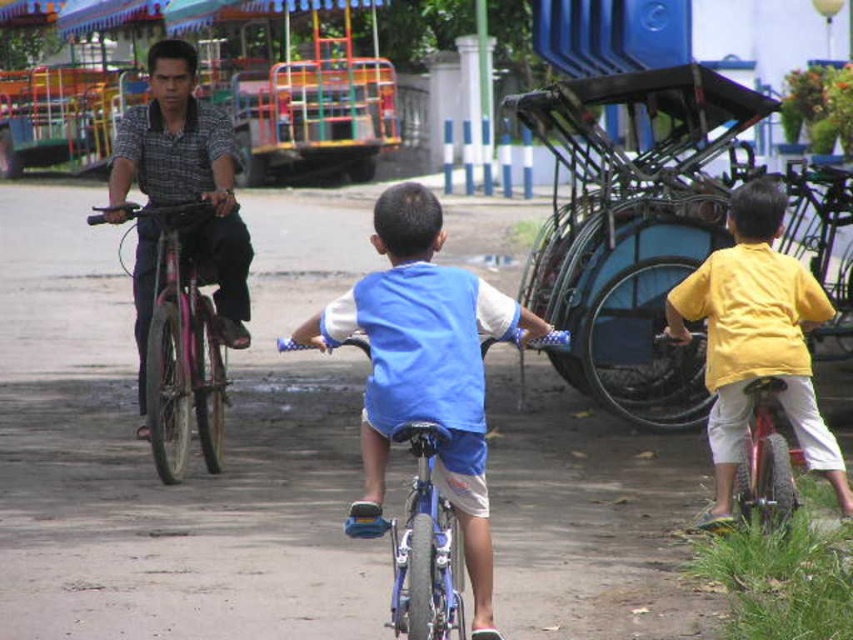
You are a photographer trying to capture a photo of both the blue fabric shirt at center and the matte black shirt at left. Since you want both subjects to be clearly visible in the frame, which subject should you focus on first to ensure both are in focus?

You should focus on the matte black shirt at left first because the blue fabric shirt at center is in front of it, allowing the photographer to capture both in focus by focusing on the subject further back.

You are a photographer trying to capture a photo of the matte black shirt at left and the pink matte bicycle at left. You need to ensure that both subjects fit within the frame. Based on their widths, will you need to adjust your camera angle to include both?

The matte black shirt at left might be wider than the pink matte bicycle at left, so adjusting the camera angle may be necessary to ensure both fit within the frame.